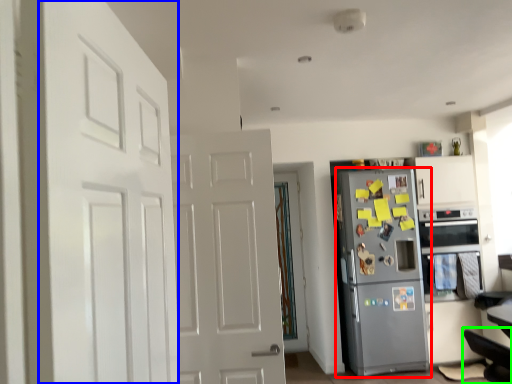
Question: Which object is the closest to the refrigerator (highlighted by a red box)? Choose among these: door (highlighted by a blue box) or swivel chair (highlighted by a green box).

Choices:
 (A) door
 (B) swivel chair

Answer: (B)